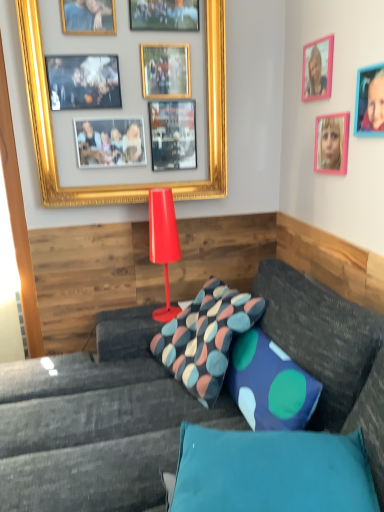
Where is `textured gray couch at center`? textured gray couch at center is located at coordinates (97, 424).

What is the approximate height of multicolored fabric pillow at center, the 2th pillow when ordered from front to back?

multicolored fabric pillow at center, the 2th pillow when ordered from front to back, is 13.88 inches tall.

Describe the element at coordinates (369, 101) in the screenshot. This screenshot has width=384, height=512. I see `pink plastic picture frame at upper right, positioned as the 4th picture frame in left-to-right order` at that location.

What do you see at coordinates (163, 243) in the screenshot? I see `shiny red lamp at center` at bounding box center [163, 243].

Find the location of a particular element. This screenshot has height=512, width=384. pink plastic picture frame at upper right, which ranks as the 2th picture frame in left-to-right order is located at coordinates (317, 69).

This screenshot has width=384, height=512. What are the coordinates of `gold/gilded picture frame at upper left, which is the first picture frame in left-to-right order` in the screenshot? It's located at (123, 184).

Is the depth of gold/gilded picture frame at upper left, which appears as the fourth picture frame when viewed from the right, less than that of textured gray couch at center?

No.

Does gold/gilded picture frame at upper left, which appears as the fourth picture frame when viewed from the right, have a greater height compared to textured gray couch at center?

Yes.

Is gold/gilded picture frame at upper left, which is the first picture frame in left-to-right order, facing away from textured gray couch at center?

gold/gilded picture frame at upper left, which is the first picture frame in left-to-right order, is not turned away from textured gray couch at center.

Is gold/gilded picture frame at upper left, which appears as the fourth picture frame when viewed from the right, bigger or smaller than textured gray couch at center?

gold/gilded picture frame at upper left, which appears as the fourth picture frame when viewed from the right, is smaller than textured gray couch at center.

Who is smaller, multicolored fabric pillow at center, the first pillow viewed from the back, or pink plastic picture frame at upper right, positioned as the 4th picture frame in left-to-right order?

pink plastic picture frame at upper right, positioned as the 4th picture frame in left-to-right order.

From a real-world perspective, is multicolored fabric pillow at center, the first pillow viewed from the back, beneath pink plastic picture frame at upper right, positioned as the 4th picture frame in left-to-right order?

Indeed, from a real-world perspective, multicolored fabric pillow at center, the first pillow viewed from the back, is positioned beneath pink plastic picture frame at upper right, positioned as the 4th picture frame in left-to-right order.

Is multicolored fabric pillow at center, the 2th pillow when ordered from front to back, at the left side of pink plastic picture frame at upper right, positioned as the 4th picture frame in left-to-right order?

Correct, you'll find multicolored fabric pillow at center, the 2th pillow when ordered from front to back, to the left of pink plastic picture frame at upper right, positioned as the 4th picture frame in left-to-right order.

From the image's perspective, is multicolored fabric pillow at center, the 2th pillow when ordered from front to back, on pink plastic picture frame at upper right, positioned as the 4th picture frame in left-to-right order?

A: Incorrect, from the image's perspective, multicolored fabric pillow at center, the 2th pillow when ordered from front to back, is lower than pink plastic picture frame at upper right, positioned as the 4th picture frame in left-to-right order.

Who is more distant, multicolored fabric pillow at center, the first pillow viewed from the back, or shiny red lamp at center?

shiny red lamp at center is further away from the camera.

Between point (226, 352) and point (156, 242), which one is positioned in front?

Point (226, 352)

Is multicolored fabric pillow at center, the 2th pillow when ordered from front to back, oriented away from shiny red lamp at center?

No, multicolored fabric pillow at center, the 2th pillow when ordered from front to back,'s orientation is not away from shiny red lamp at center.

Between point (184, 341) and point (314, 65), which one is positioned in front?

The point (314, 65) is in front.

Between multicolored fabric pillow at center, the 2th pillow when ordered from front to back, and pink plastic picture frame at upper right, which ranks as the 2th picture frame in left-to-right order, which one is positioned in front?

multicolored fabric pillow at center, the 2th pillow when ordered from front to back, is closer to the camera.

Is multicolored fabric pillow at center, the 2th pillow when ordered from front to back, turned away from pink plastic picture frame at upper right, which ranks as the 2th picture frame in left-to-right order?

No.

Considering the sizes of objects multicolored fabric pillow at center, the 2th pillow when ordered from front to back, and pink plastic picture frame at upper right, which ranks as the 2th picture frame in left-to-right order, in the image provided, who is wider, multicolored fabric pillow at center, the 2th pillow when ordered from front to back, or pink plastic picture frame at upper right, which ranks as the 2th picture frame in left-to-right order,?

Wider between the two is multicolored fabric pillow at center, the 2th pillow when ordered from front to back.

Which of these two, gold/gilded picture frame at upper left, which is the first picture frame in left-to-right order, or pink plastic picture frame at upper right, which ranks as the 2th picture frame in left-to-right order, is thinner?

pink plastic picture frame at upper right, which ranks as the 2th picture frame in left-to-right order, is thinner.

Starting from the gold/gilded picture frame at upper left, which appears as the fourth picture frame when viewed from the right, which picture frame is the 1st one to the right? Please provide its 2D coordinates.

[(317, 69)]

Is point (226, 115) more distant than point (314, 84)?

That is True.

Visually, is gold/gilded picture frame at upper left, which appears as the fourth picture frame when viewed from the right, positioned to the left or to the right of pink plastic picture frame at upper right, which is the 3th picture frame from right to left?

In the image, gold/gilded picture frame at upper left, which appears as the fourth picture frame when viewed from the right, appears on the left side of pink plastic picture frame at upper right, which is the 3th picture frame from right to left.

Can you confirm if multicolored fabric pillow at center, the 2th pillow when ordered from front to back, is wider than textured gray couch at center?

No.

From the image's perspective, is multicolored fabric pillow at center, the first pillow viewed from the back, above textured gray couch at center?

Yes, from the image's perspective, multicolored fabric pillow at center, the first pillow viewed from the back, is over textured gray couch at center.

Would you say multicolored fabric pillow at center, the first pillow viewed from the back, is to the left or to the right of textured gray couch at center in the picture?

multicolored fabric pillow at center, the first pillow viewed from the back, is positioned on textured gray couch at center's right side.

From a real-world perspective, between textured gray couch at center and pink plastic picture frame at upper right, which is the 3th picture frame from right to left, who is vertically lower?

textured gray couch at center.

Between textured gray couch at center and pink plastic picture frame at upper right, which is the 3th picture frame from right to left, which one has smaller width?

pink plastic picture frame at upper right, which is the 3th picture frame from right to left.

This screenshot has width=384, height=512. I want to click on studio couch below the gold/gilded picture frame at upper left, which appears as the fourth picture frame when viewed from the right (from the image's perspective), so click(97, 424).

I want to click on pillow lying behind the pink plastic picture frame at upper right, which is counted as the 1th picture frame, starting from the right, so click(205, 338).

When comparing their distances from multicolored fabric pillow at center, the first pillow viewed from the back, does pink plastic picture frame at upper right, which is the 3th picture frame from right to left, or teal fabric pillow at lower center, the 1th pillow in the front-to-back sequence, seem closer?

The object closer to multicolored fabric pillow at center, the first pillow viewed from the back, is teal fabric pillow at lower center, the 1th pillow in the front-to-back sequence.

From the image, which object appears to be nearer to textured gray couch at center, multicolored fabric pillow at center, the 2th pillow when ordered from front to back, or pink plastic picture frame at upper right, which is the 3th picture frame from right to left?

Among the two, multicolored fabric pillow at center, the 2th pillow when ordered from front to back, is located nearer to textured gray couch at center.

From the image, which object appears to be farther from multicolored fabric pillow at center, the first pillow viewed from the back, gold/gilded picture frame at upper left, which is the first picture frame in left-to-right order, or pink plastic picture frame at upper right, which ranks as the 2th picture frame in left-to-right order?

pink plastic picture frame at upper right, which ranks as the 2th picture frame in left-to-right order, lies further to multicolored fabric pillow at center, the first pillow viewed from the back, than the other object.

Considering their positions, is teal fabric pillow at lower center, the 1th pillow in the front-to-back sequence, positioned further to gold/gilded picture frame at upper left, which is the first picture frame in left-to-right order, than pink plastic picture frame at upper right, acting as the third picture frame starting from the left?

teal fabric pillow at lower center, the 1th pillow in the front-to-back sequence, lies further to gold/gilded picture frame at upper left, which is the first picture frame in left-to-right order, than the other object.

Looking at the image, which one is located further to pink plastic picture frame at upper right, which ranks as the 2th picture frame in left-to-right order, shiny red lamp at center or gold/gilded picture frame at upper left, which appears as the fourth picture frame when viewed from the right?

Among the two, shiny red lamp at center is located further to pink plastic picture frame at upper right, which ranks as the 2th picture frame in left-to-right order.

Looking at the image, which one is located closer to pink plastic picture frame at upper right, positioned as the 4th picture frame in left-to-right order, textured gray couch at center or teal fabric pillow at lower center, the 1th pillow in the front-to-back sequence?

teal fabric pillow at lower center, the 1th pillow in the front-to-back sequence, is positioned closer to the anchor pink plastic picture frame at upper right, positioned as the 4th picture frame in left-to-right order.

Which object lies further to the anchor point gold/gilded picture frame at upper left, which is the first picture frame in left-to-right order, textured gray couch at center or pink plastic picture frame at upper right, which is counted as the 1th picture frame, starting from the right?

textured gray couch at center is further to gold/gilded picture frame at upper left, which is the first picture frame in left-to-right order.

Based on their spatial positions, is teal fabric pillow at lower center, the 1th pillow in the front-to-back sequence, or textured gray couch at center further from shiny red lamp at center?

teal fabric pillow at lower center, the 1th pillow in the front-to-back sequence, is positioned further to the anchor shiny red lamp at center.

The height and width of the screenshot is (512, 384). What are the coordinates of `studio couch between gold/gilded picture frame at upper left, which is the first picture frame in left-to-right order, and teal fabric pillow at lower center, the 1th pillow in the front-to-back sequence, vertically` in the screenshot? It's located at (97, 424).

I want to click on studio couch between pink plastic picture frame at upper right, which is the 3th picture frame from right to left, and teal fabric pillow at lower center, the 1th pillow in the front-to-back sequence, in the vertical direction, so click(x=97, y=424).

Find the location of a particular element. This screenshot has height=512, width=384. lamp between pink plastic picture frame at upper right, which is counted as the 1th picture frame, starting from the right, and multicolored fabric pillow at center, the 2th pillow when ordered from front to back, from top to bottom is located at coordinates (163, 243).

Where is `lamp between gold/gilded picture frame at upper left, which appears as the fourth picture frame when viewed from the right, and textured gray couch at center vertically`? lamp between gold/gilded picture frame at upper left, which appears as the fourth picture frame when viewed from the right, and textured gray couch at center vertically is located at coordinates pyautogui.click(x=163, y=243).